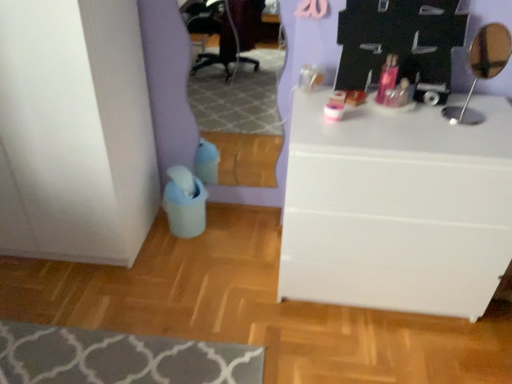
Question: From the image's perspective, relative to gray textured rug at lower left, is metallic silver mirror at upper right above or below?

Choices:
 (A) above
 (B) below

Answer: (A)

Question: Considering the positions of metallic silver mirror at upper right and gray textured rug at lower left in the image, is metallic silver mirror at upper right bigger or smaller than gray textured rug at lower left?

Choices:
 (A) small
 (B) big

Answer: (A)

Question: Estimate the real-world distances between objects in this image. Which object is closer to the gray textured rug at lower left?

Choices:
 (A) white matte chest of drawers at center
 (B) metallic silver mirror at upper right

Answer: (A)

Question: Based on their relative distances, which object is farther from the gray textured rug at lower left?

Choices:
 (A) white matte chest of drawers at center
 (B) metallic silver mirror at upper right

Answer: (B)